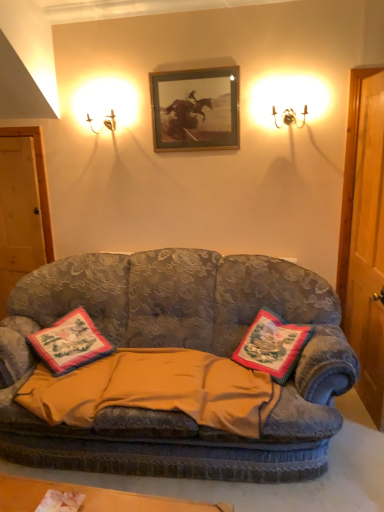
Question: In terms of width, does yellow cotton blanket at center look wider or thinner when compared to wooden door at left?

Choices:
 (A) thin
 (B) wide

Answer: (B)

Question: From a real-world perspective, relative to wooden door at left, is yellow cotton blanket at center vertically above or below?

Choices:
 (A) above
 (B) below

Answer: (B)

Question: Which is farther from the embroidered fabric pillow at center, the first pillow viewed from the left?

Choices:
 (A) yellow cotton blanket at center
 (B) gold-framed picture at upper center
 (C) velvet fabric couch at center
 (D) metallic wall sconce at upper left
 (E) wooden door at left

Answer: (D)

Question: Which is nearer to the gold-framed picture at upper center?

Choices:
 (A) yellow cotton blanket at center
 (B) metallic wall sconce at upper left
 (C) wooden door at left
 (D) velvet fabric couch at center
 (E) embroidered fabric pillow at center, which ranks as the first pillow in right-to-left order

Answer: (B)